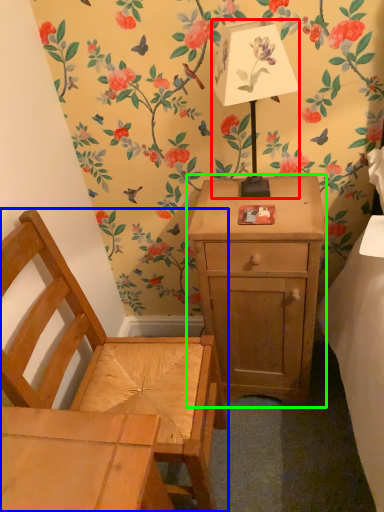
Question: Which object is the farthest from table lamp (highlighted by a red box)? Choose among these: chair (highlighted by a blue box) or nightstand (highlighted by a green box).

Choices:
 (A) chair
 (B) nightstand

Answer: (A)